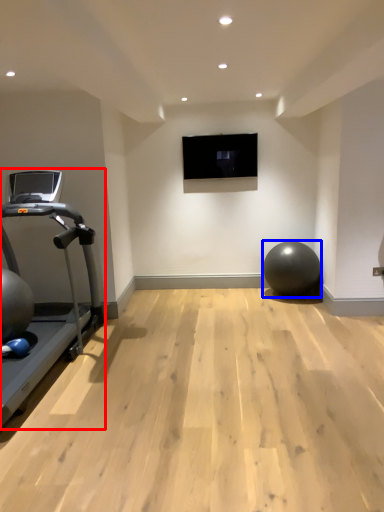
Question: Among these objects, which one is nearest to the camera, treadmill (highlighted by a red box) or ball (highlighted by a blue box)?

Choices:
 (A) treadmill
 (B) ball

Answer: (A)